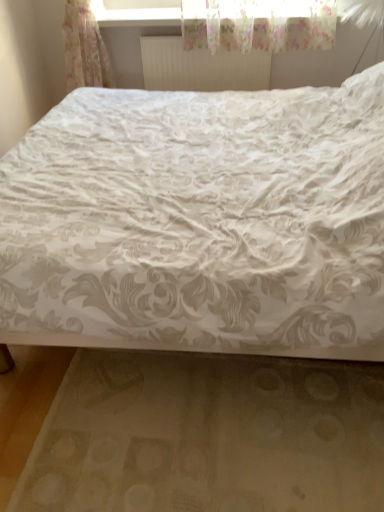
Question: In terms of height, does transparent plastic window frame at upper center look taller or shorter compared to white matte radiator at upper center?

Choices:
 (A) short
 (B) tall

Answer: (A)

Question: Visually, is transparent plastic window frame at upper center positioned to the left or to the right of white matte radiator at upper center?

Choices:
 (A) right
 (B) left

Answer: (A)

Question: Which object is the farthest from the transparent plastic window frame at upper center?

Choices:
 (A) white fabric bed frame at lower center
 (B) white floral fabric bed at center
 (C) white matte radiator at upper center

Answer: (A)

Question: Estimate the real-world distances between objects in this image. Which object is closer to the white fabric bed frame at lower center?

Choices:
 (A) white matte radiator at upper center
 (B) white floral fabric bed at center
 (C) transparent plastic window frame at upper center

Answer: (B)